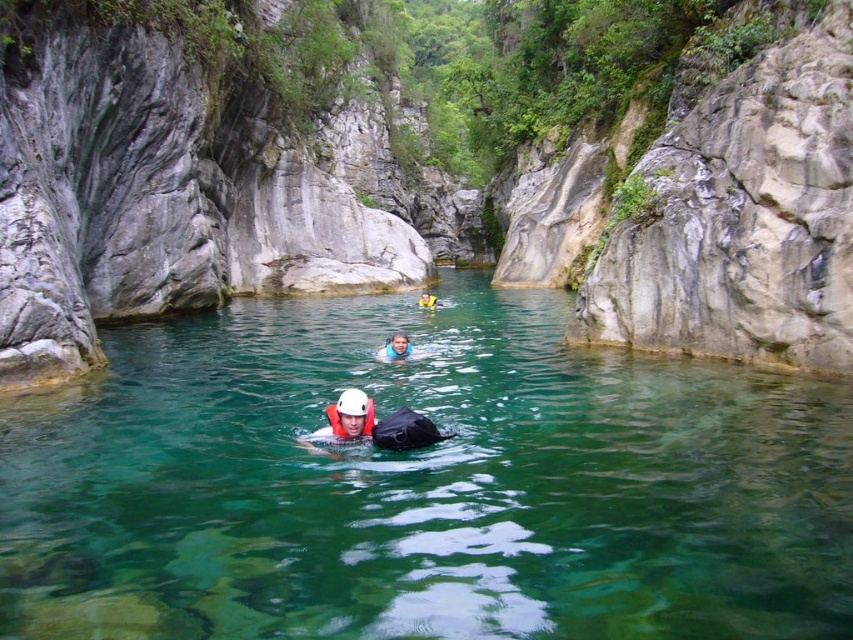
Question: Which object is farther from the camera taking this photo?

Choices:
 (A) white matte helmet at center
 (B) white matte life jacket at center
 (C) orange life jacket at center

Answer: (C)

Question: Estimate the real-world distances between objects in this image. Which object is closer to the smooth rock canyon at center?

Choices:
 (A) orange life jacket at center
 (B) clear water at center

Answer: (B)

Question: Which object is farther from the camera taking this photo?

Choices:
 (A) orange life jacket at center
 (B) white matte life jacket at center

Answer: (A)

Question: Can you confirm if white matte helmet at center is positioned to the right of white matte life jacket at center?

Choices:
 (A) yes
 (B) no

Answer: (B)

Question: In this image, where is white matte helmet at center located relative to white matte life jacket at center?

Choices:
 (A) below
 (B) above

Answer: (B)

Question: Is smooth rock canyon at center wider than blue fabric at center?

Choices:
 (A) yes
 (B) no

Answer: (A)